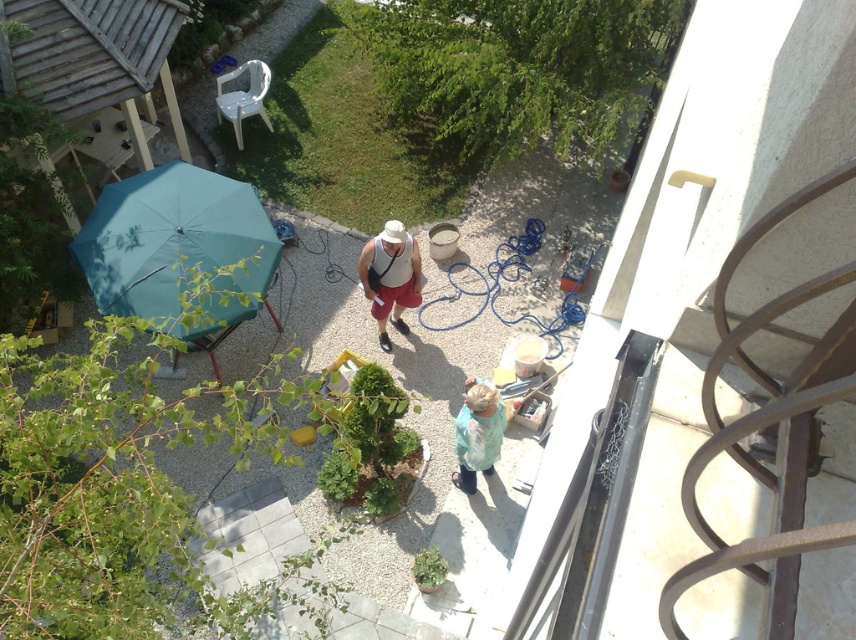
You are standing on the balcony and want to throw a small ball to a friend who is at the point marked by the coordinates point (215, 202). If the ball travels in a straight line, will it reach your friend without hitting the railing?

The point (215, 202) is 8.11 meters away from the viewer, so if the ball is thrown in a straight line, it should reach the friend at point (215, 202) without hitting the railing, assuming there are no obstacles in between.

Looking at this image, you are standing on the balcony and want to throw a small ball to someone standing at the point marked as point (210, 253). If the ball travels in a straight line, will it pass over the railing? Please explain your reasoning.

The point (210, 253) is 7.58 meters away from the viewer. Since the railing is part of the balcony structure where the viewer is standing, the ball thrown to that point would travel horizontally away from the balcony, not over the railing. The railing is along the edge of the balcony, so the ball would go past it towards the garden area below.

You are standing on the balcony and want to place a new potted plant. The teal fabric umbrella at left is located at point (176, 244). Where should you place the new potted plant so it is directly to the right of the teal fabric umbrella at left?

Place the new potted plant at point (176, 244) plus 0.05 in the x direction. Since the teal fabric umbrella at left is at point (176, 244), adding 0.05 to the x coordinate would place it directly to the right.